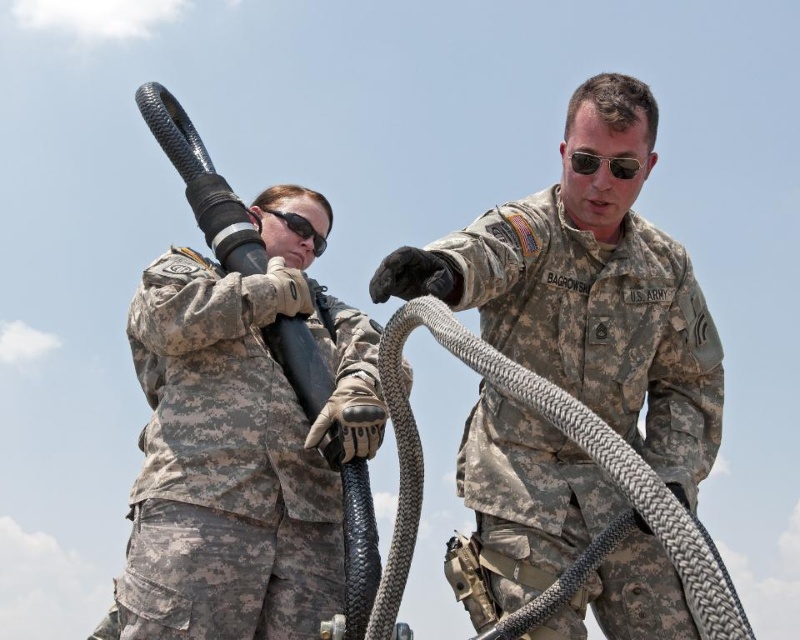
Question: Does camouflage fabric us army uniform at center appear on the left side of sunglasses at center?

Choices:
 (A) no
 (B) yes

Answer: (B)

Question: Which point is farther to the camera?

Choices:
 (A) (145, 548)
 (B) (616, 212)
 (C) (274, 212)

Answer: (C)

Question: Does camouflage fabric us army uniform at center have a greater width compared to sunglasses at center?

Choices:
 (A) yes
 (B) no

Answer: (A)

Question: Which is farther from the camouflage fabric uniform at center?

Choices:
 (A) sunglasses at center
 (B) camouflage fabric us army uniform at center

Answer: (A)

Question: Does camouflage fabric us army uniform at center appear over sunglasses at center?

Choices:
 (A) yes
 (B) no

Answer: (B)

Question: Among these points, which one is farthest from the camera?

Choices:
 (A) (588, 154)
 (B) (220, 552)

Answer: (B)